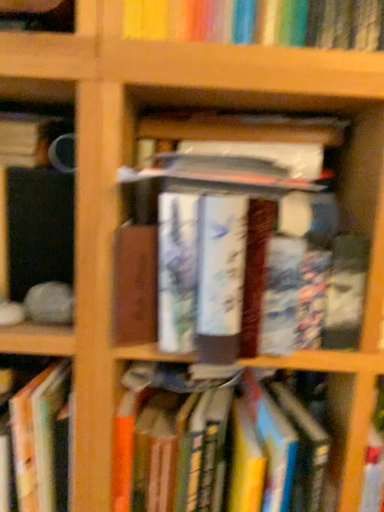
Question: Should I look upward or downward to see hardcover book at lower left, the second book from the bottom?

Choices:
 (A) up
 (B) down

Answer: (B)

Question: Is hardcover book at center, which is the first book in bottom-to-top order, a part of matte black mug at left, which is the fourth book in bottom-to-top order?

Choices:
 (A) no
 (B) yes

Answer: (A)

Question: Does matte black mug at left, arranged as the 1th book when viewed from the top, lie behind hardcover book at center, which is counted as the fourth book, starting from the top?

Choices:
 (A) no
 (B) yes

Answer: (B)

Question: Considering the relative sizes of matte black mug at left, which is the fourth book in bottom-to-top order, and hardcover book at center, which is the first book in bottom-to-top order, in the image provided, is matte black mug at left, which is the fourth book in bottom-to-top order, wider than hardcover book at center, which is the first book in bottom-to-top order,?

Choices:
 (A) no
 (B) yes

Answer: (A)

Question: Does matte black mug at left, which is the fourth book in bottom-to-top order, have a lesser width compared to hardcover book at center, which is the first book in bottom-to-top order?

Choices:
 (A) yes
 (B) no

Answer: (A)

Question: Is matte black mug at left, arranged as the 1th book when viewed from the top, taller than hardcover book at center, which is counted as the fourth book, starting from the top?

Choices:
 (A) yes
 (B) no

Answer: (B)

Question: Is matte black mug at left, arranged as the 1th book when viewed from the top, outside hardcover book at center, which is counted as the fourth book, starting from the top?

Choices:
 (A) no
 (B) yes

Answer: (B)

Question: Is matte black mug at left, which is the fourth book in bottom-to-top order, completely or partially outside of hardcover book at lower left, the third book when ordered from top to bottom?

Choices:
 (A) no
 (B) yes

Answer: (B)

Question: Can you confirm if matte black mug at left, which is the fourth book in bottom-to-top order, is thinner than hardcover book at lower left, the second book from the bottom?

Choices:
 (A) yes
 (B) no

Answer: (A)

Question: Does matte black mug at left, arranged as the 1th book when viewed from the top, appear on the right side of hardcover book at lower left, the third book when ordered from top to bottom?

Choices:
 (A) no
 (B) yes

Answer: (A)

Question: Can you confirm if matte black mug at left, arranged as the 1th book when viewed from the top, is bigger than hardcover book at lower left, the second book from the bottom?

Choices:
 (A) no
 (B) yes

Answer: (A)

Question: From the image's perspective, does matte black mug at left, which is the fourth book in bottom-to-top order, appear higher than hardcover book at lower left, the second book from the bottom?

Choices:
 (A) no
 (B) yes

Answer: (B)

Question: Is matte black mug at left, which is the fourth book in bottom-to-top order, far from hardcover book at lower left, the third book when ordered from top to bottom?

Choices:
 (A) yes
 (B) no

Answer: (B)

Question: Does hardcover book at lower left, the second book from the bottom, have a smaller size compared to hardcover book at center, the 2th book from the top?

Choices:
 (A) yes
 (B) no

Answer: (A)